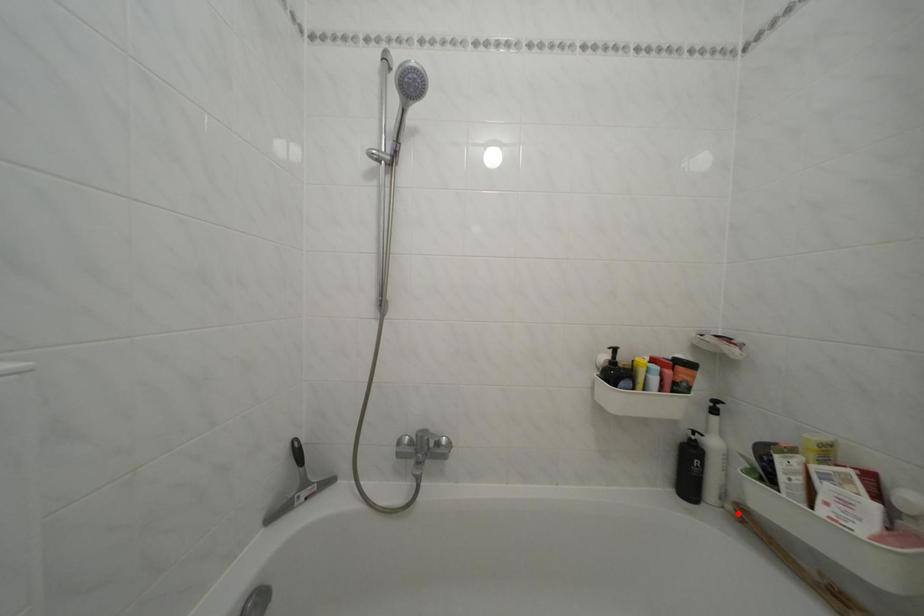
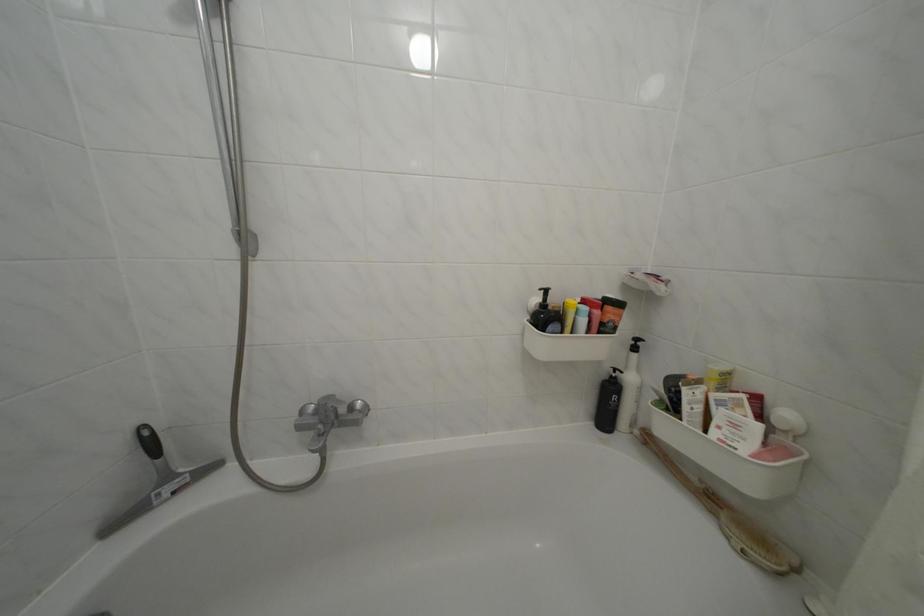
Question: I am providing you with two images of the same scene from different viewpoints. A red point is shown in image1. For the corresponding object point in image2, is it positioned nearer or farther from the camera?

Choices:
 (A) Nearer
 (B) Farther

Answer: (B)